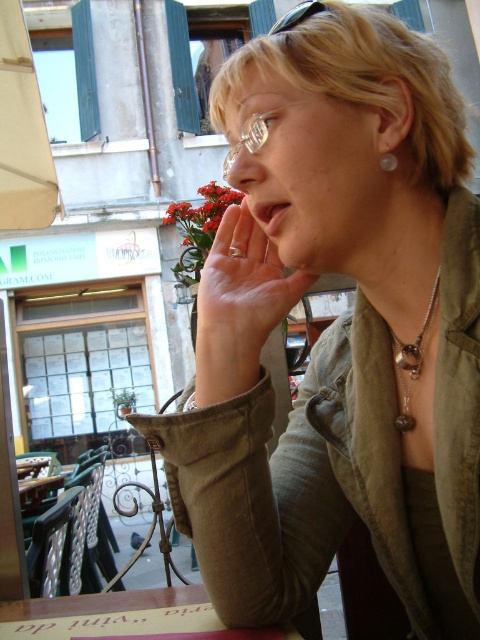
Question: Which of the following is the farthest from the observer?

Choices:
 (A) (190, 426)
 (B) (63, 600)

Answer: (B)

Question: Does matte skin hand at center appear over wooden table at lower center?

Choices:
 (A) yes
 (B) no

Answer: (A)

Question: Which point is farther to the camera?

Choices:
 (A) matte skin hand at center
 (B) pearl-like white earring at ear
 (C) matte skin nose at center

Answer: (C)

Question: Which object is positioned closest to the clear plastic glasses at center?

Choices:
 (A) matte skin hand at center
 (B) matte skin nose at center
 (C) wooden table at lower center
 (D) pearl-like white earring at ear

Answer: (B)

Question: Does wooden table at lower center lie in front of pearl-like white earring at ear?

Choices:
 (A) no
 (B) yes

Answer: (A)

Question: Can you confirm if silver metallic necklace at center is positioned below clear plastic glasses at center?

Choices:
 (A) no
 (B) yes

Answer: (B)